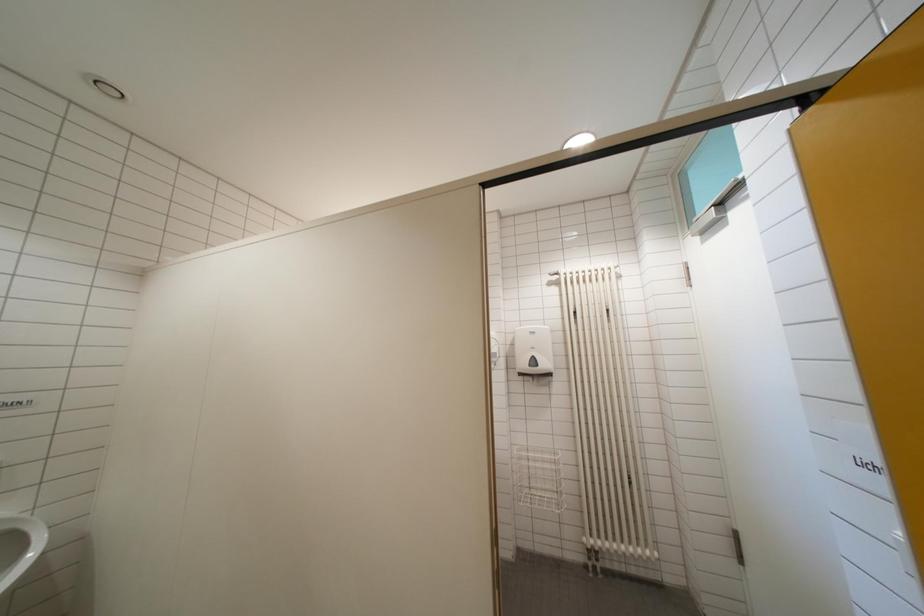
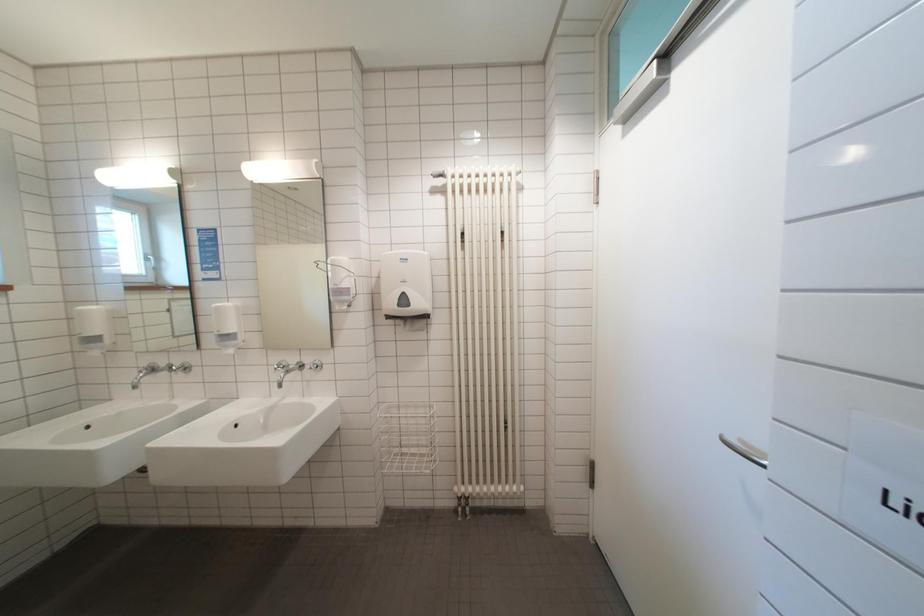
Question: How did the camera likely rotate?

Choices:
 (A) Left
 (B) Right
 (C) Up
 (D) Down

Answer: (B)